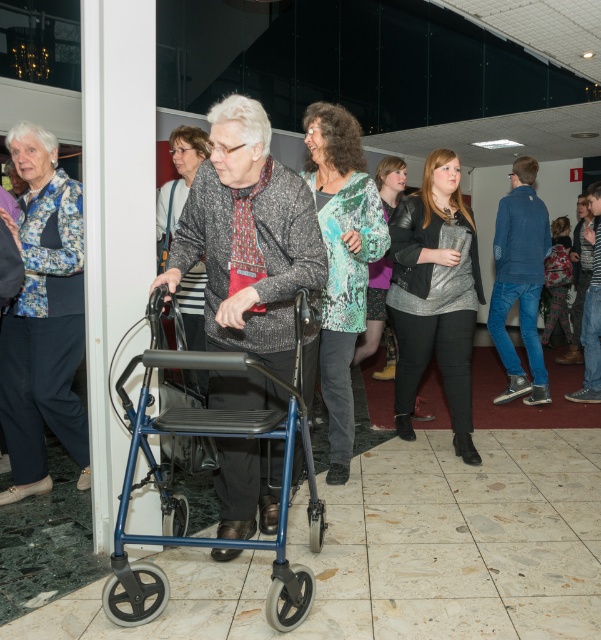
You are standing at the point marked by the coordinates point (519,280). What object are you currently standing on?

The point (519,280) is on the denim jacket at right.

You are organizing a space for a wheelchair user and need to ensure there is enough room to maneuver. Given that the wheelchair requires a minimum of 90 cm of width, can the blue metallic walker at center be moved aside to allow passage if the green textured sweater at center is placed next to it?

The blue metallic walker at center is wider than the green textured sweater at center. Since the walker is wider, moving it aside would require more space. However, the question specifies placing the sweater next to the walker. The combined width of both items would depend on their individual dimensions. The description only states the walker is wider than the sweater, but without exact measurements, we cannot confirm if their combined width exceeds 90 cm. Therefore, it is uncertain if there would be enough

You are a fashion designer observing the social gathering. You notice two denim jackets in the scene. How far apart are the denim jacket at right and the denim jacket at center?

The denim jacket at right and the denim jacket at center are 18.20 inches apart.